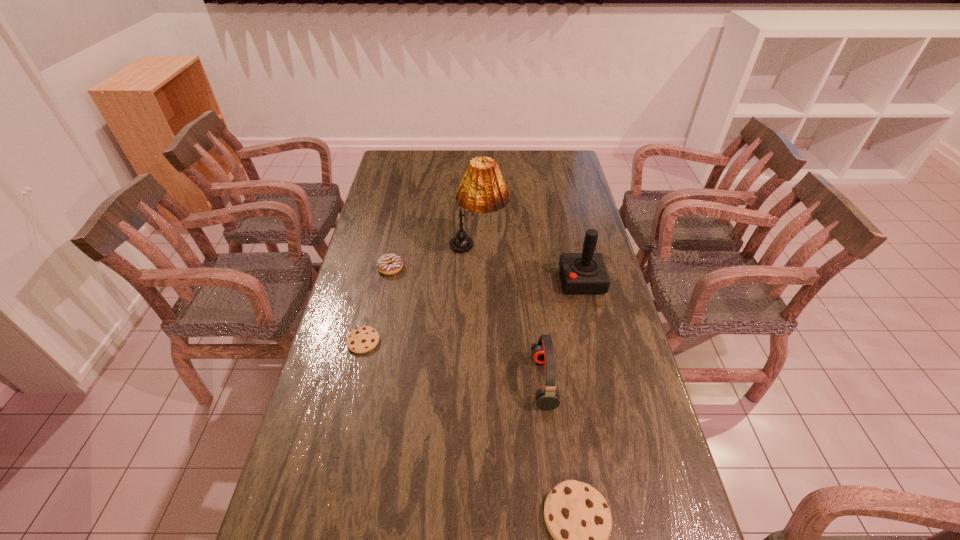
Identify the location of the shorter cookie. (360, 340).

Where is `the left cookie`? The image size is (960, 540). the left cookie is located at coordinates (360, 340).

What are the coordinates of `the second tallest object` in the screenshot? It's located at (582, 273).

Identify the location of the tallest object. (482, 190).

Locate an element on the screen. The width and height of the screenshot is (960, 540). the third object from left to right is located at coordinates pyautogui.click(x=482, y=190).

You are a GUI agent. You are given a task and a screenshot of the screen. Output one action in this format:
    pyautogui.click(x=<x>, y=<y>)
    Task: Click on the fourth shortest object
    
    Given the screenshot: What is the action you would take?
    pyautogui.click(x=542, y=352)

Find the location of `doughnut`. doughnut is located at coordinates (395, 262).

Find the location of `free space located on the front of the farther cookie`. free space located on the front of the farther cookie is located at coordinates (338, 450).

The image size is (960, 540). I want to click on vacant space located on the base of the fifth shortest object, so click(x=515, y=280).

Locate an element on the screen. free region located on the base of the fifth shortest object is located at coordinates (520, 280).